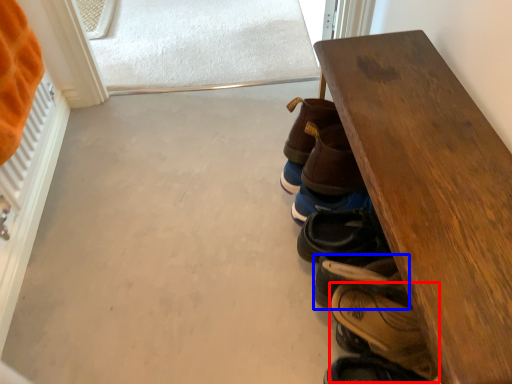
Question: Which point is further to the camera, footwear (highlighted by a red box) or footwear (highlighted by a blue box)?

Choices:
 (A) footwear
 (B) footwear

Answer: (A)